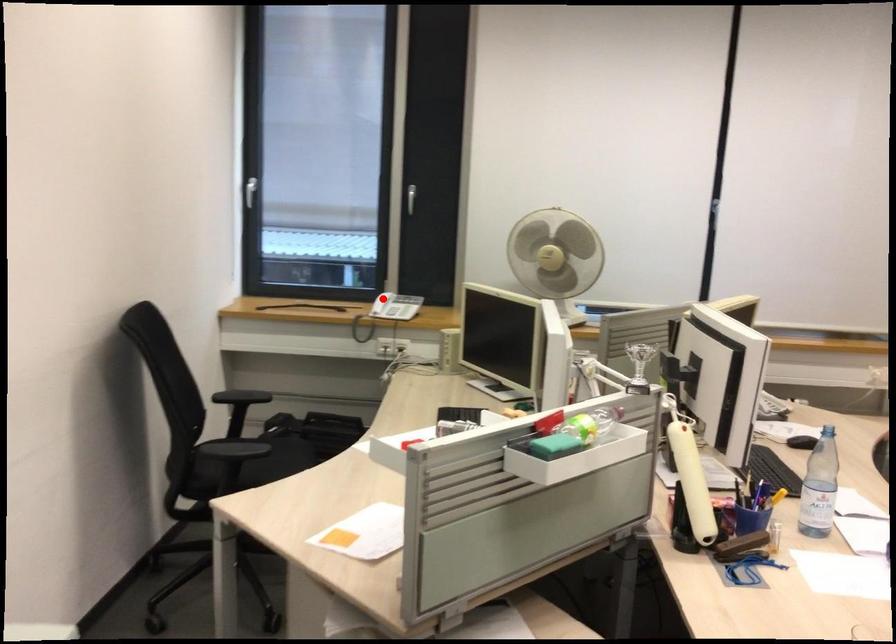
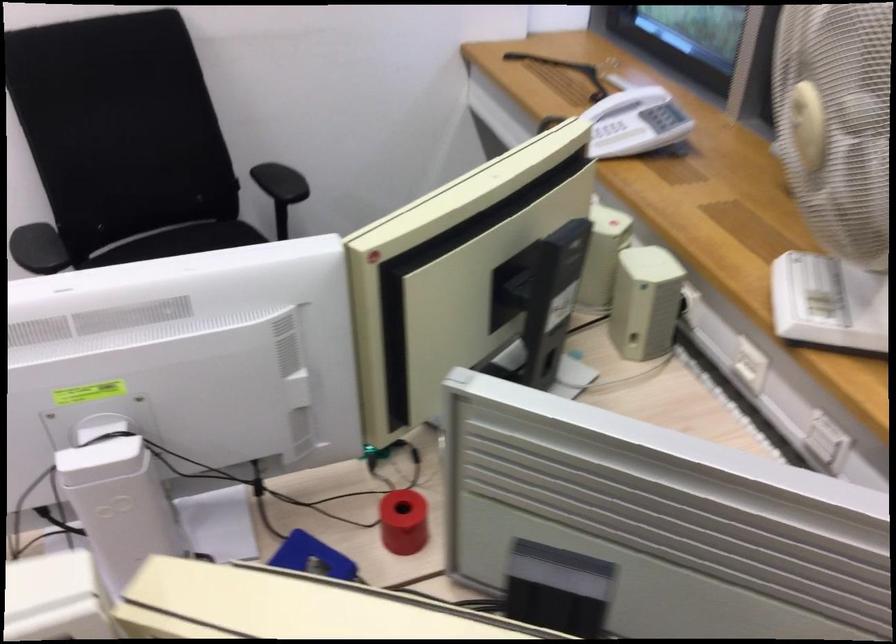
Question: A red point is marked in image1. In image2, is the corresponding 3D point closer to the camera or farther? Reply with the corresponding letter.

Choices:
 (A) The corresponding 3D point is closer.
 (B) The corresponding 3D point is farther.

Answer: (A)